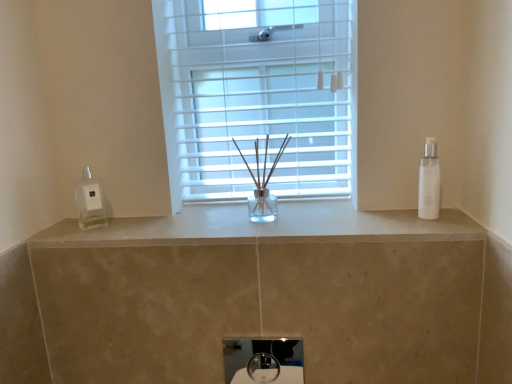
The image size is (512, 384). I want to click on free space that is to the left of white glossy bottle at right, so [349, 212].